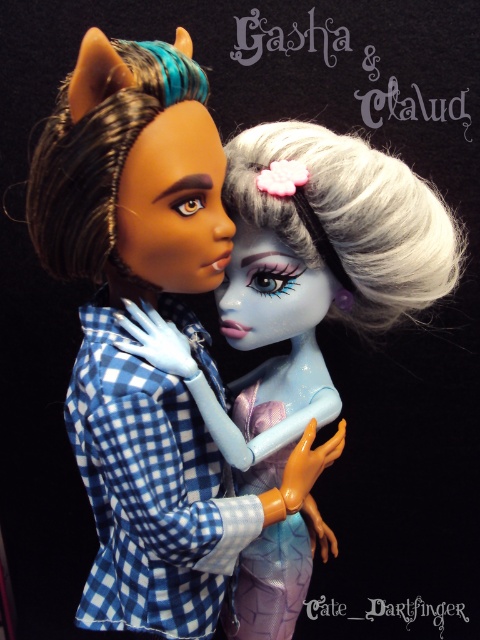
Does shiny blue hair at center have a larger size compared to matte blue checkered shirt at center?

Incorrect, shiny blue hair at center is not larger than matte blue checkered shirt at center.

Does shiny blue hair at center have a lesser height compared to matte blue checkered shirt at center?

No.

Does point (73, 182) lie behind point (284, 188)?

No.

In order to click on shiny blue hair at center in this screenshot , I will do `click(165, 317)`.